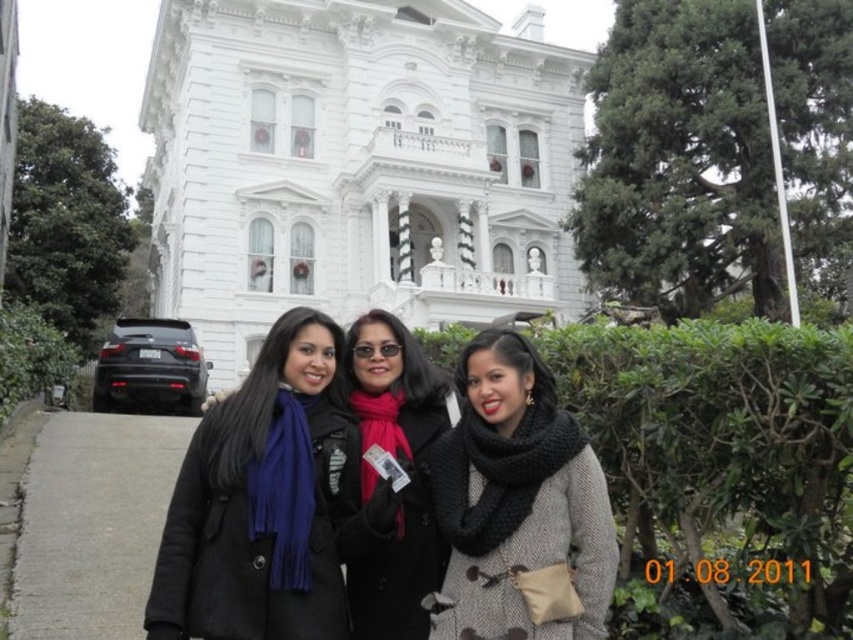
Question: Estimate the real-world distances between objects in this image. Which object is closer to the green leafy hedge at lower right?

Choices:
 (A) gray concrete pavement at lower left
 (B) matte black coat at center
 (C) white stone mansion at center

Answer: (B)

Question: Which object is positioned closest to the matte black coat at center?

Choices:
 (A) green leafy hedge at lower right
 (B) black knitted scarf at center
 (C) blue scarf at center

Answer: (C)

Question: Is white stone mansion at center to the left of black knitted scarf at center from the viewer's perspective?

Choices:
 (A) yes
 (B) no

Answer: (A)

Question: Does white stone mansion at center appear on the right side of blue scarf at center?

Choices:
 (A) no
 (B) yes

Answer: (A)

Question: Which point is closer to the camera?

Choices:
 (A) green leafy hedge at lower right
 (B) white stone mansion at center
 (C) blue scarf at center

Answer: (A)

Question: Does gray concrete pavement at lower left appear under matte black coat at center?

Choices:
 (A) yes
 (B) no

Answer: (A)